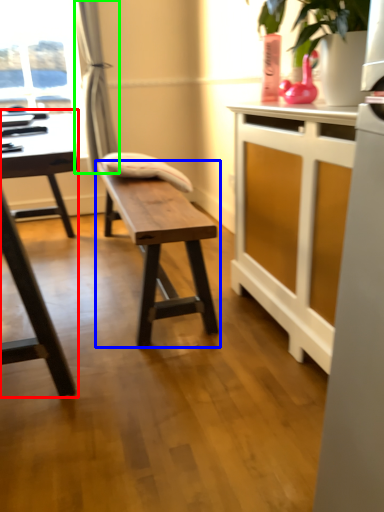
Question: Considering the real-world distances, which object is farthest from table (highlighted by a red box)? table (highlighted by a blue box) or curtain (highlighted by a green box)?

Choices:
 (A) table
 (B) curtain

Answer: (B)